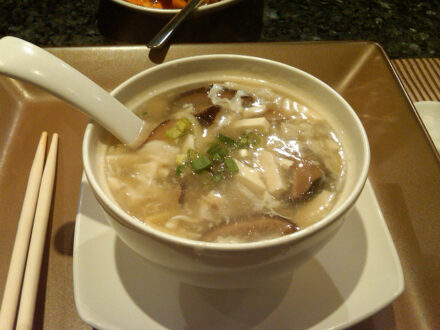
Locate an element on the screen. This screenshot has width=440, height=330. handle of a utensil is located at coordinates (157, 40).